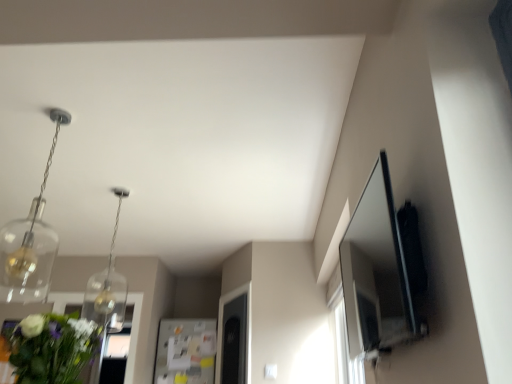
Question: Would you say clear glass pendant at upper left, acting as the second light fixture starting from the back, is to the left or to the right of green leafy bouquet at lower left in the picture?

Choices:
 (A) left
 (B) right

Answer: (A)

Question: Looking at the image, does clear glass pendant at upper left, the 1th light fixture viewed from the front, seem bigger or smaller compared to green leafy bouquet at lower left?

Choices:
 (A) small
 (B) big

Answer: (A)

Question: Estimate the real-world distances between objects in this image. Which object is closer to the clear glass pendant at upper left, acting as the second light fixture starting from the back?

Choices:
 (A) clear glass pendant light at upper left, the 2th light fixture positioned from the front
 (B) green leafy bouquet at lower left

Answer: (A)

Question: Estimate the real-world distances between objects in this image. Which object is farther from the green leafy bouquet at lower left?

Choices:
 (A) clear glass pendant light at upper left, marked as the 1th light fixture in a back-to-front arrangement
 (B) clear glass pendant at upper left, acting as the second light fixture starting from the back

Answer: (A)